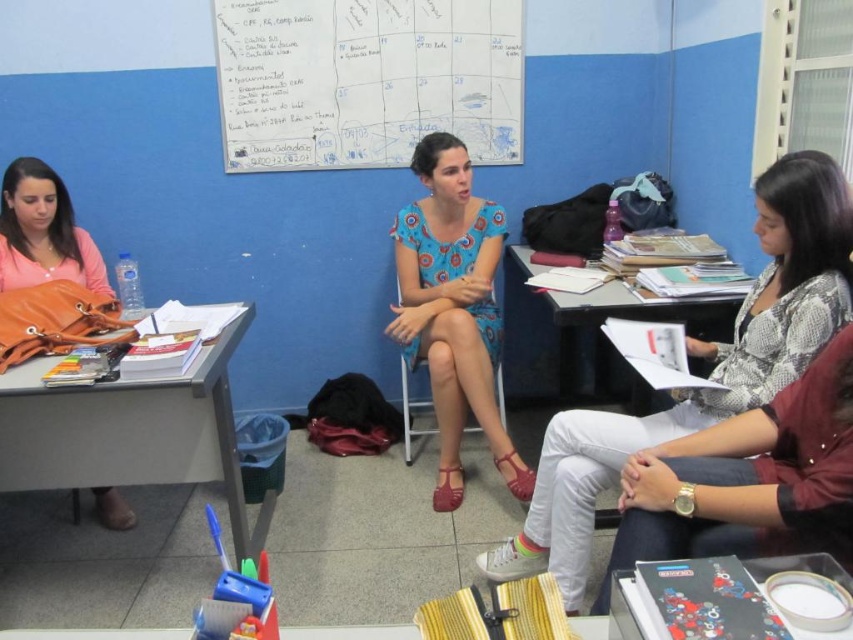
Question: Which is farther from the matte orange purse at left?

Choices:
 (A) white paper at center
 (B) blue printed dress at center
 (C) blue floral dress at center

Answer: (C)

Question: Is blue printed dress at center smaller than matte orange purse at left?

Choices:
 (A) no
 (B) yes

Answer: (A)

Question: Can you confirm if blue floral dress at center is positioned above white paper at center?

Choices:
 (A) no
 (B) yes

Answer: (A)

Question: Which point is closer to the camera taking this photo?

Choices:
 (A) coord(517,83)
 (B) coord(476,403)

Answer: (B)

Question: Does blue floral dress at center lie behind orange fabric table at left?

Choices:
 (A) no
 (B) yes

Answer: (A)

Question: Which point is farther from the camera taking this photo?

Choices:
 (A) (467, 92)
 (B) (108, 486)
 (C) (804, 300)
 (D) (468, 189)

Answer: (A)